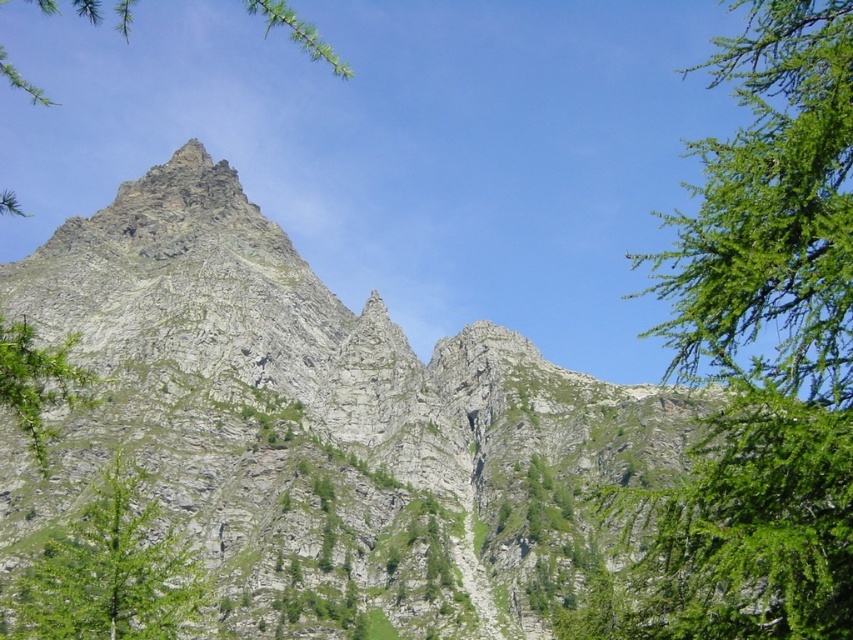
Question: Which object is farther from the camera taking this photo?

Choices:
 (A) green leafy tree at upper right
 (B) green leafy shrub at left
 (C) green lichen-covered rock at upper center
 (D) green leafy tree at lower left

Answer: (C)

Question: From the image, what is the correct spatial relationship of green leafy tree at lower left in relation to green leafy tree at upper center?

Choices:
 (A) below
 (B) above

Answer: (A)

Question: Does green leafy tree at lower left have a greater width compared to green leafy shrub at left?

Choices:
 (A) yes
 (B) no

Answer: (B)

Question: Which object is positioned farthest from the green leafy tree at lower left?

Choices:
 (A) green lichen-covered rock at upper center
 (B) green leafy shrub at left
 (C) green leafy tree at upper center

Answer: (C)

Question: Which point is farther to the camera?

Choices:
 (A) green leafy shrub at left
 (B) green lichen-covered rock at upper center

Answer: (B)

Question: Does green leafy tree at upper center have a greater width compared to green lichen-covered rock at upper center?

Choices:
 (A) yes
 (B) no

Answer: (A)